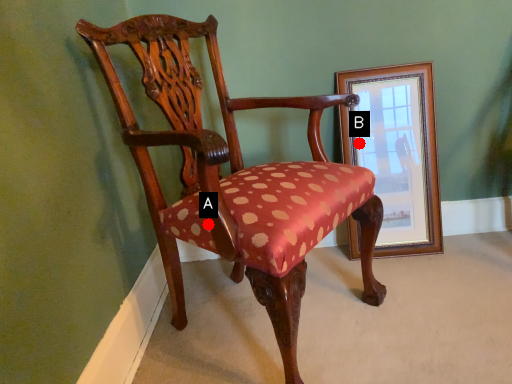
Question: Two points are circled on the image, labeled by A and B beside each circle. Which point is closer to the camera taking this photo?

Choices:
 (A) A is closer
 (B) B is closer

Answer: (A)